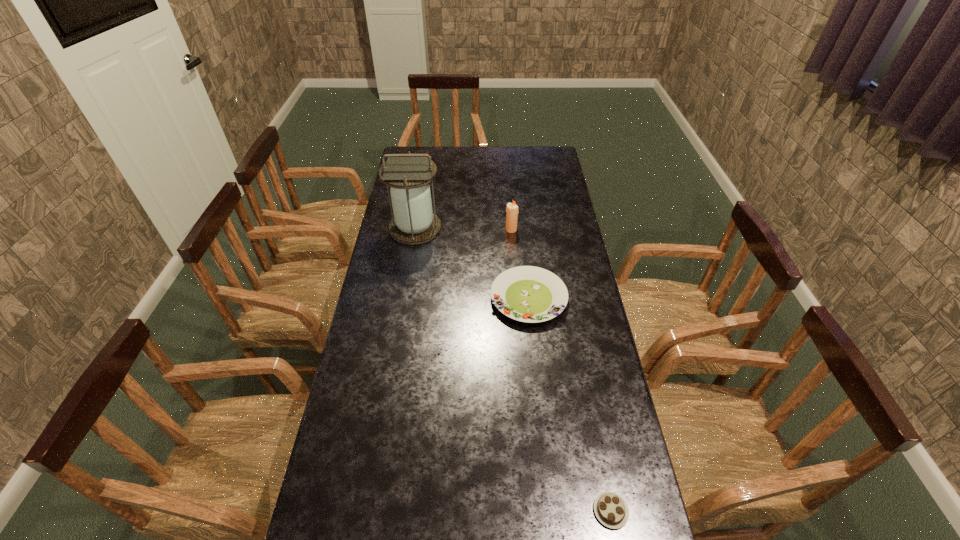
I want to click on free space between the salad plate and the chocolate cake, so click(569, 404).

Find the location of a particular element. vacant area that lies between the lantern and the third shortest object is located at coordinates (463, 229).

The width and height of the screenshot is (960, 540). Identify the location of unoccupied position between the lantern and the third farthest object. (472, 263).

Where is `vacant space that's between the second tallest object and the second shortest object`? vacant space that's between the second tallest object and the second shortest object is located at coordinates (520, 264).

Where is `empty space that is in between the third shortest object and the tallest object`? empty space that is in between the third shortest object and the tallest object is located at coordinates (463, 229).

Image resolution: width=960 pixels, height=540 pixels. Find the location of `free spot between the chocolate cake and the salad plate`. free spot between the chocolate cake and the salad plate is located at coordinates (569, 404).

What are the coordinates of `empty space between the lantern and the candle` in the screenshot? It's located at (463, 229).

At what (x,y) coordinates should I click in order to perform the action: click on object that is the closest to the third shortest object. Please return your answer as a coordinate pair (x, y). Image resolution: width=960 pixels, height=540 pixels. Looking at the image, I should click on (530, 294).

Where is `object that stands as the closest to the candle`? The height and width of the screenshot is (540, 960). object that stands as the closest to the candle is located at coordinates (530, 294).

Find the location of a particular element. blank area in the image that satisfies the following two spatial constraints: 1. on the front side of the lantern; 2. on the left side of the second shortest object is located at coordinates (404, 298).